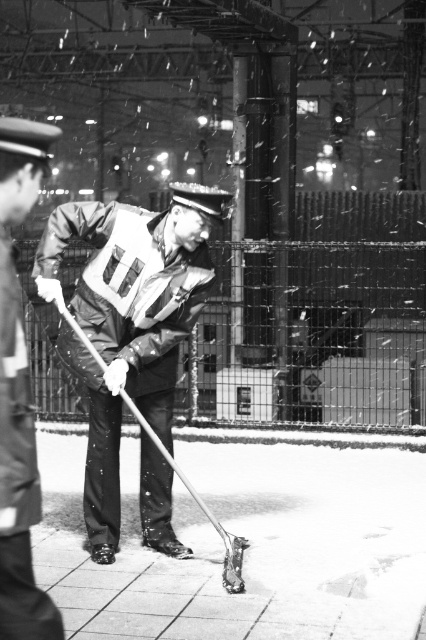
Can you confirm if smooth concrete pavement at center is positioned below rubberized black jacket at center?

Yes.

Find the location of a particular element. The width and height of the screenshot is (426, 640). smooth concrete pavement at center is located at coordinates (250, 545).

What are the coordinates of `smooth concrete pavement at center` in the screenshot? It's located at (250, 545).

At what (x,y) coordinates should I click in order to perform the action: click on smooth concrete pavement at center. Please return your answer as a coordinate pair (x, y). The width and height of the screenshot is (426, 640). Looking at the image, I should click on (250, 545).

Does point (94, 504) lie behind point (40, 609)?

Yes.

From the picture: Does rubberized black jacket at center have a lesser height compared to uniformed man at center?

No, rubberized black jacket at center is not shorter than uniformed man at center.

Does point (229, 196) come in front of point (17, 618)?

No, (229, 196) is further to viewer.

Locate an element on the screen. This screenshot has width=426, height=640. rubberized black jacket at center is located at coordinates (129, 321).

Is point (141, 433) in front of point (157, 307)?

No, (141, 433) is further to viewer.

Measure the distance between point [161,308] and camera.

The distance of point [161,308] from camera is 6.40 meters.

Find the location of a particular element. Image resolution: width=426 pixels, height=640 pixels. rubberized black jacket at center is located at coordinates (129, 321).